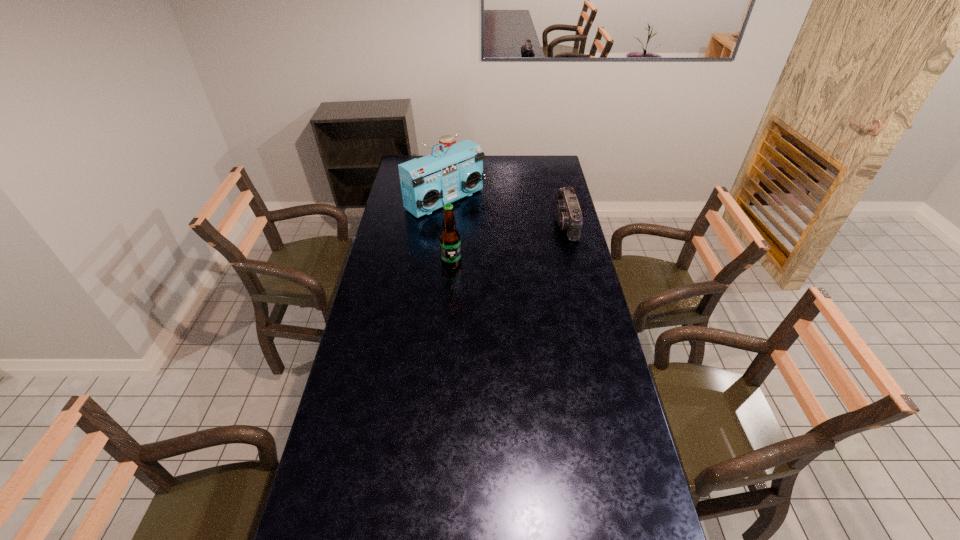
Where is `free space at the right edge`? free space at the right edge is located at coordinates (562, 275).

The width and height of the screenshot is (960, 540). I want to click on vacant space that's between the farthest object and the rightmost object, so click(508, 193).

Identify the location of empty space between the can and the rightmost object. The width and height of the screenshot is (960, 540). (508, 193).

Identify the location of empty space that is in between the nearest object and the rightmost object. This screenshot has height=540, width=960. (509, 244).

Locate an element on the screen. This screenshot has height=540, width=960. free space that is in between the radio receiver and the camcorder is located at coordinates (506, 212).

This screenshot has width=960, height=540. Identify the location of unoccupied position between the camcorder and the can. (508, 193).

At what (x,y) coordinates should I click in order to perform the action: click on vacant region between the camcorder and the radio receiver. Please return your answer as a coordinate pair (x, y). This screenshot has height=540, width=960. Looking at the image, I should click on (506, 212).

What are the coordinates of `vacant area that lies between the rightmost object and the radio receiver` in the screenshot? It's located at (506, 212).

Where is `the second closest object to the radio receiver`? the second closest object to the radio receiver is located at coordinates (450, 242).

Select which object is the second closest to the camcorder. Please provide its 2D coordinates. Your answer should be formatted as a tuple, i.e. [(x, y)], where the tuple contains the x and y coordinates of a point satisfying the conditions above.

[(450, 242)]